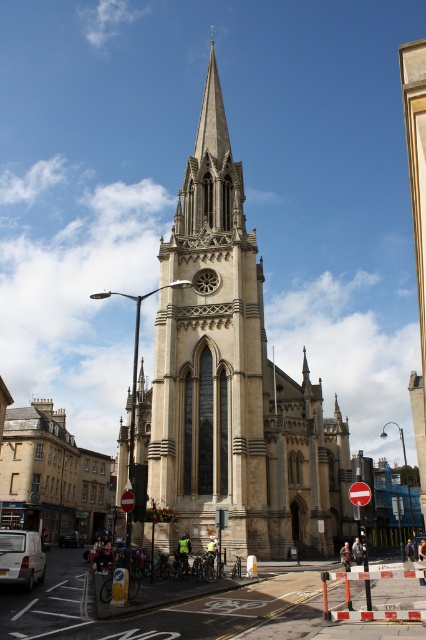
Which of these two, beige stone church at lower left or white matte van at lower left, stands taller?

beige stone church at lower left

Which is above, beige stone church at lower left or white matte van at lower left?

Positioned higher is white matte van at lower left.

Describe the element at coordinates (49, 474) in the screenshot. This screenshot has width=426, height=640. I see `beige stone church at lower left` at that location.

Locate an element on the screen. The height and width of the screenshot is (640, 426). beige stone church at lower left is located at coordinates (49, 474).

Does point (218, 296) come in front of point (100, 477)?

Yes, it is in front of point (100, 477).

Locate an element on the screen. The height and width of the screenshot is (640, 426). beige stone tower at center is located at coordinates (232, 385).

Image resolution: width=426 pixels, height=640 pixels. Find the location of `beige stone tower at center`. beige stone tower at center is located at coordinates (232, 385).

Between beige stone tower at center and white matte van at lower left, which one appears on the right side from the viewer's perspective?

Positioned to the right is beige stone tower at center.

Does beige stone tower at center appear on the left side of white matte van at lower left?

Incorrect, beige stone tower at center is not on the left side of white matte van at lower left.

Where is `beige stone tower at center`? beige stone tower at center is located at coordinates (232, 385).